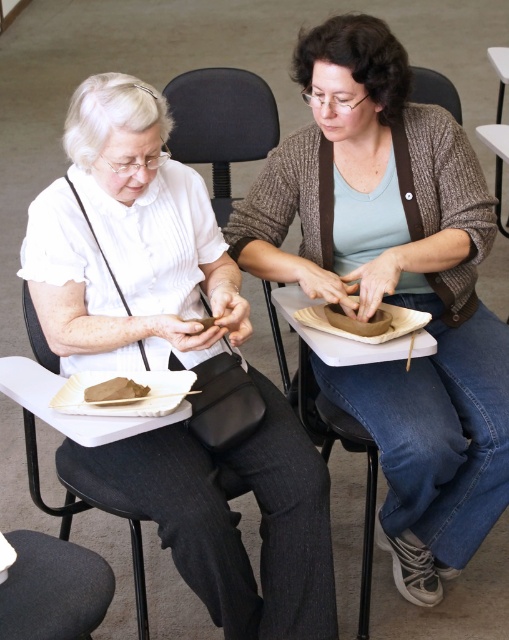
In the scene shown: Can you confirm if black plastic chair at upper center is wider than knitted fabric chair at center?

Yes, black plastic chair at upper center is wider than knitted fabric chair at center.

Does black plastic chair at upper center appear under knitted fabric chair at center?

Correct, black plastic chair at upper center is located below knitted fabric chair at center.

Between point (173, 150) and point (438, 81), which one is positioned in front?

Positioned in front is point (438, 81).

Locate an element on the screen. The width and height of the screenshot is (509, 640). black plastic chair at upper center is located at coordinates pyautogui.click(x=220, y=124).

Which of these two, knitted fabric chair at center or white plastic table at center, stands taller?

With more height is knitted fabric chair at center.

Can you confirm if knitted fabric chair at center is positioned to the right of white plastic table at center?

In fact, knitted fabric chair at center is to the left of white plastic table at center.

Describe the element at coordinates (435, 90) in the screenshot. I see `knitted fabric chair at center` at that location.

Where is `knitted fabric chair at center`? The width and height of the screenshot is (509, 640). knitted fabric chair at center is located at coordinates (435, 90).

Based on the photo, who is lower down, black plastic chair at upper center or brown paper bag at lower left?

Positioned lower is brown paper bag at lower left.

Is black plastic chair at upper center in front of brown paper bag at lower left?

No, black plastic chair at upper center is behind brown paper bag at lower left.

Is point (258, 84) farther from viewer compared to point (124, 396)?

Yes, it is behind point (124, 396).

Identify the location of black plastic chair at upper center. (220, 124).